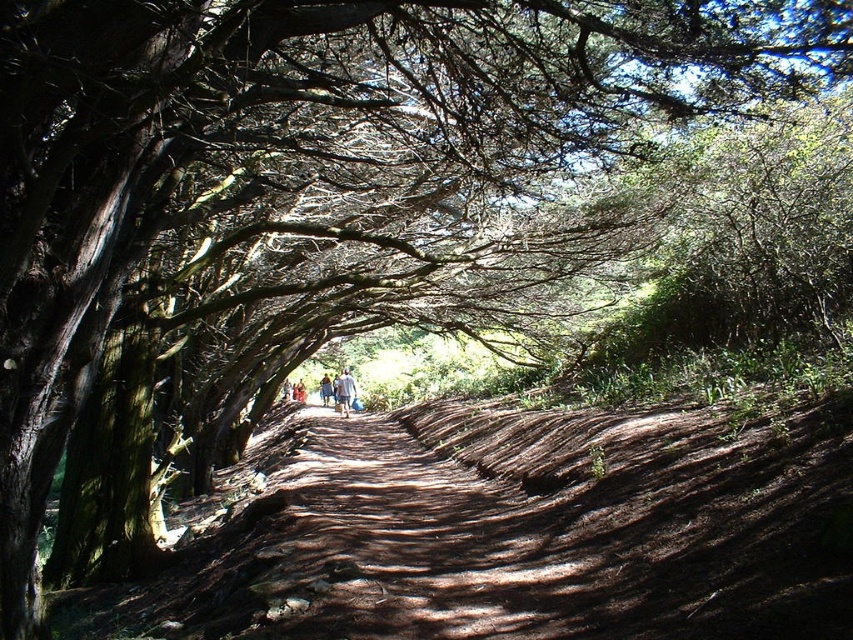
Question: In this image, where is light blue fabric at center located relative to light blue denim jeans at center?

Choices:
 (A) above
 (B) below

Answer: (A)

Question: Which object appears closest to the camera in this image?

Choices:
 (A) light blue denim jeans at center
 (B) light blue fabric at center

Answer: (B)

Question: Which of the following is the farthest from the observer?

Choices:
 (A) (328, 381)
 (B) (355, 392)

Answer: (A)

Question: Does light blue fabric at center have a greater width compared to light blue denim jeans at center?

Choices:
 (A) no
 (B) yes

Answer: (A)

Question: Is light blue fabric at center positioned at the back of light blue denim jeans at center?

Choices:
 (A) no
 (B) yes

Answer: (A)